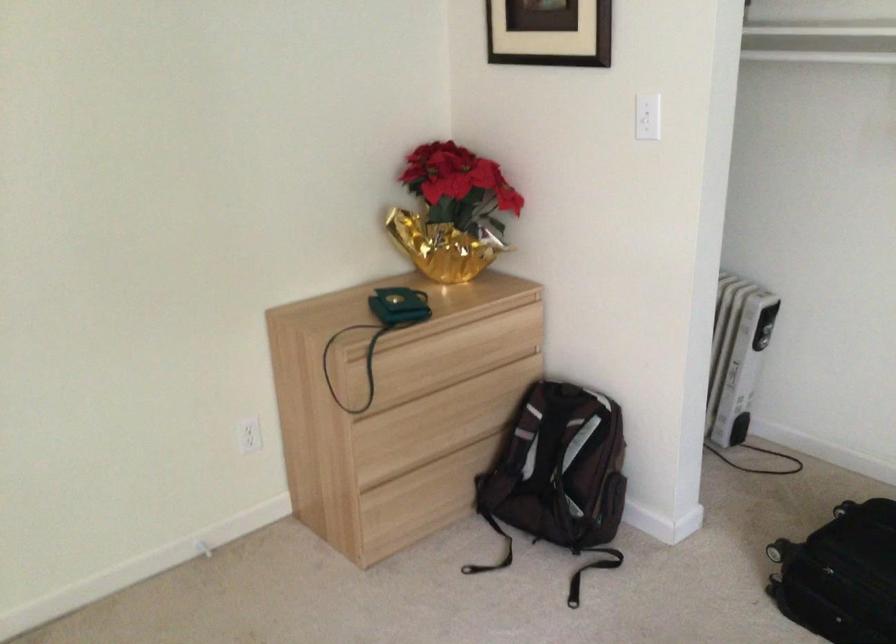
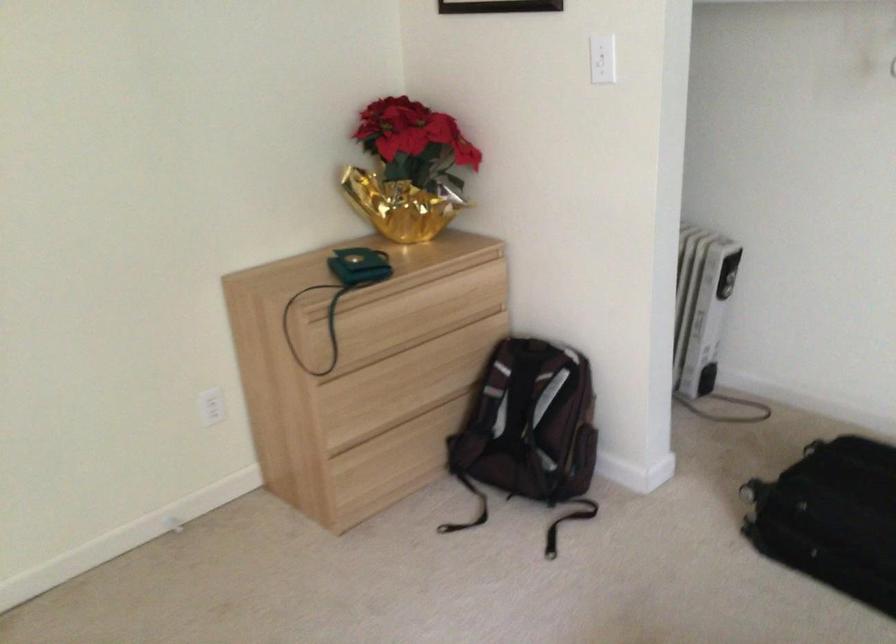
Where in the second image is the point corresponding to point 400,433 from the first image?

(366, 397)